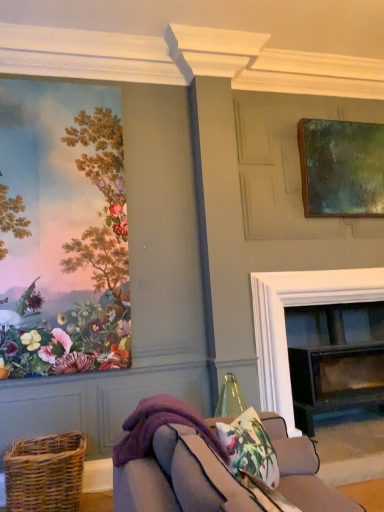
Question: Choose the correct answer: Is greenish-brown wooden frame at upper right, which appears as the first picture frame when viewed from the right, inside purple fleece blanket at lower center or outside it?

Choices:
 (A) inside
 (B) outside

Answer: (B)

Question: Is greenish-brown wooden frame at upper right, the 2th picture frame from the front, taller or shorter than purple fleece blanket at lower center?

Choices:
 (A) short
 (B) tall

Answer: (B)

Question: Based on their relative distances, which object is nearer to the greenish-brown wooden frame at upper right, arranged as the second picture frame when viewed from the left?

Choices:
 (A) black glass fireplace at center
 (B) floral fabric cushion at lower center
 (C) purple fleece blanket at lower center
 (D) purple fleece couch at lower center
 (E) matte floral wallpaper at left, the second picture frame positioned from the right

Answer: (A)

Question: Based on their relative distances, which object is farther from the floral fabric cushion at lower center?

Choices:
 (A) purple fleece couch at lower center
 (B) woven brown basket at lower left
 (C) greenish-brown wooden frame at upper right, the 2th picture frame from the front
 (D) purple fleece blanket at lower center
 (E) matte floral wallpaper at left, the 1th picture frame positioned from the front

Answer: (C)